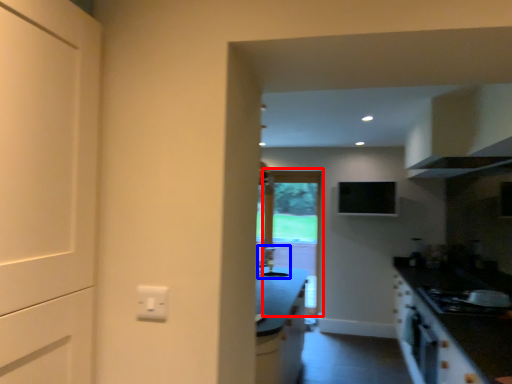
Question: Among these objects, which one is nearest to the camera, screen door (highlighted by a red box) or sink (highlighted by a blue box)?

Choices:
 (A) screen door
 (B) sink

Answer: (B)